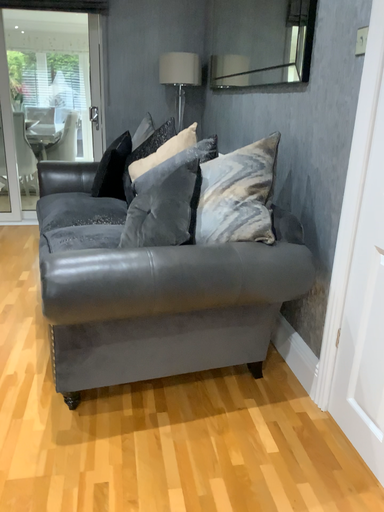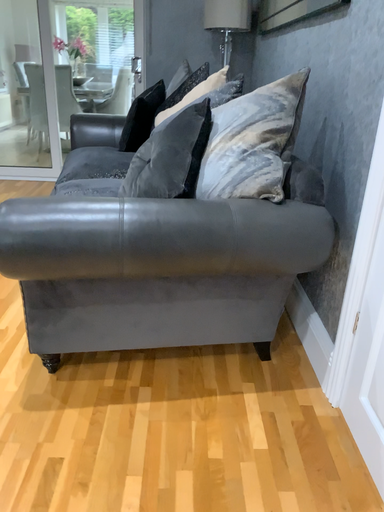
Question: Which way did the camera rotate in the video?

Choices:
 (A) rotated right
 (B) rotated left

Answer: (B)